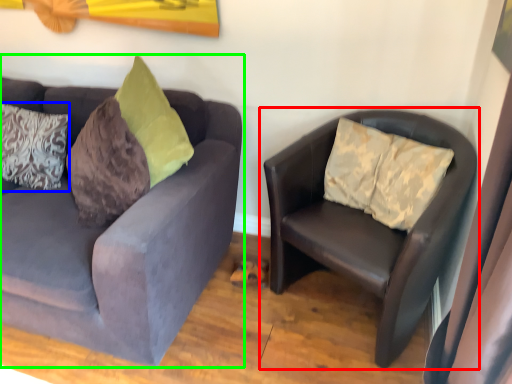
Question: Which object is positioned farthest from studio couch (highlighted by a red box)? Select from pillow (highlighted by a blue box) and studio couch (highlighted by a green box).

Choices:
 (A) pillow
 (B) studio couch

Answer: (A)